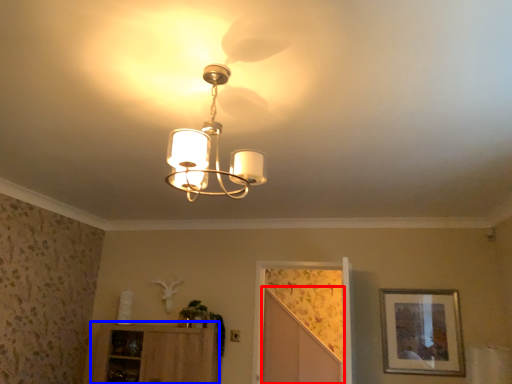
Question: Which object is closer to the camera taking this photo, screen door (highlighted by a red box) or cabinetry (highlighted by a blue box)?

Choices:
 (A) screen door
 (B) cabinetry

Answer: (B)